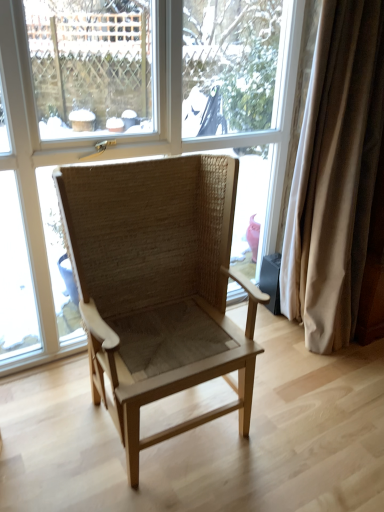
Locate an element on the screen. This screenshot has width=384, height=512. vacant space to the right of natural woven chair at center is located at coordinates (297, 424).